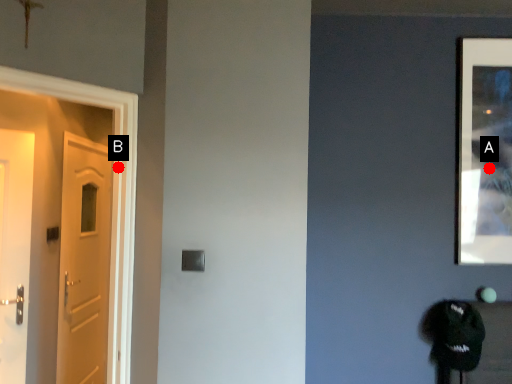
Question: Two points are circled on the image, labeled by A and B beside each circle. Which point is closer to the camera?

Choices:
 (A) A is closer
 (B) B is closer

Answer: (B)